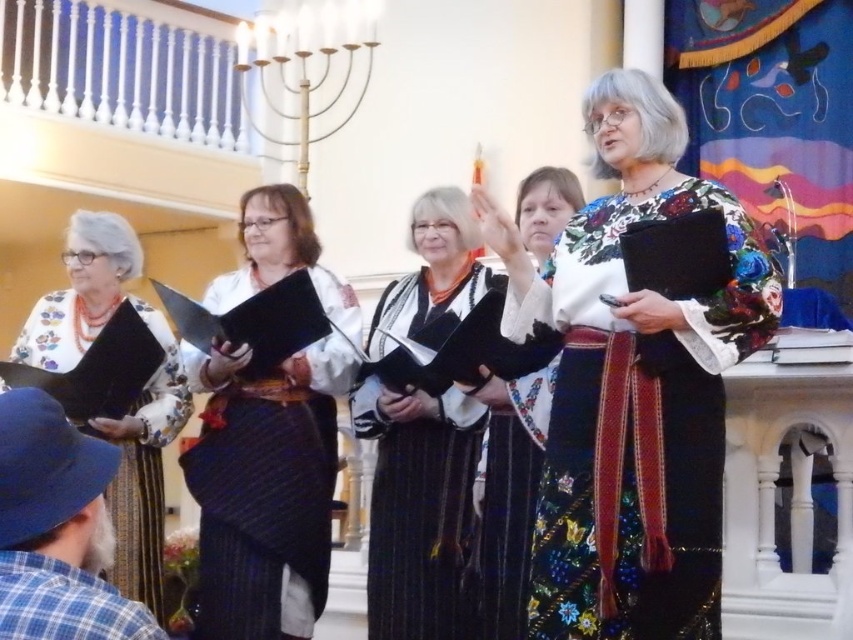
You are a stagehand setting up for a performance. You need to place a decorative item between the black paper at center and the matte black book at center. Which object should you place it closer to if you want it to be near the wider object?

The black paper at center might be wider than matte black book at center, so placing the decorative item closer to the black paper at center would position it near the wider object.

You are a photographer trying to capture the floral pattern on the dress of the woman standing at the center of the image. Given that the floral pattern is located at point (633, 387) in the image coordinates, where exactly should you focus your camera lens to ensure the pattern is in sharp focus?

The floral pattern is located at point (633, 387) on the floral patterned fabric dress at center, so you should focus your camera lens precisely at those coordinates to capture the pattern clearly.